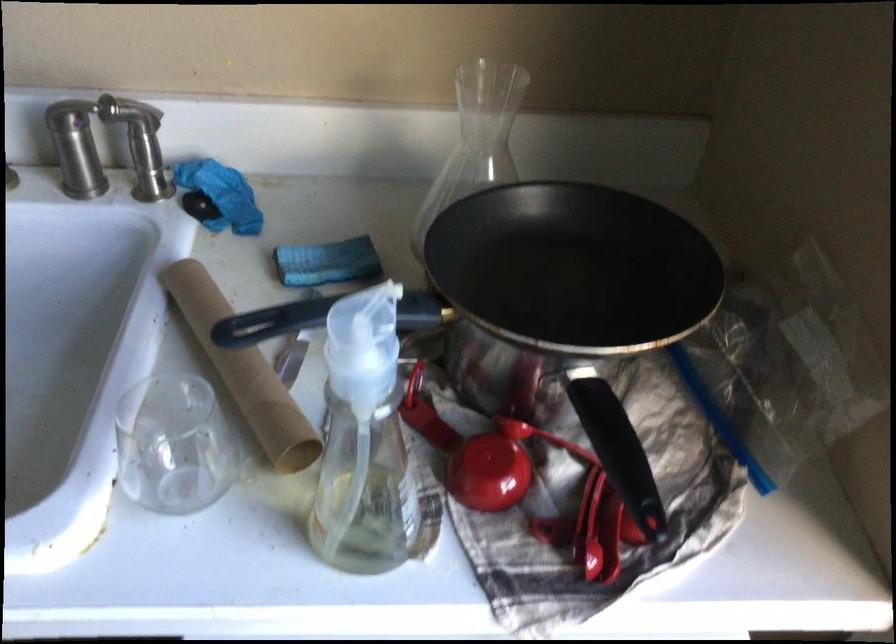
Find where to grasp the black pan handle. Please return your answer as a coordinate pair (x, y).

(618, 451)